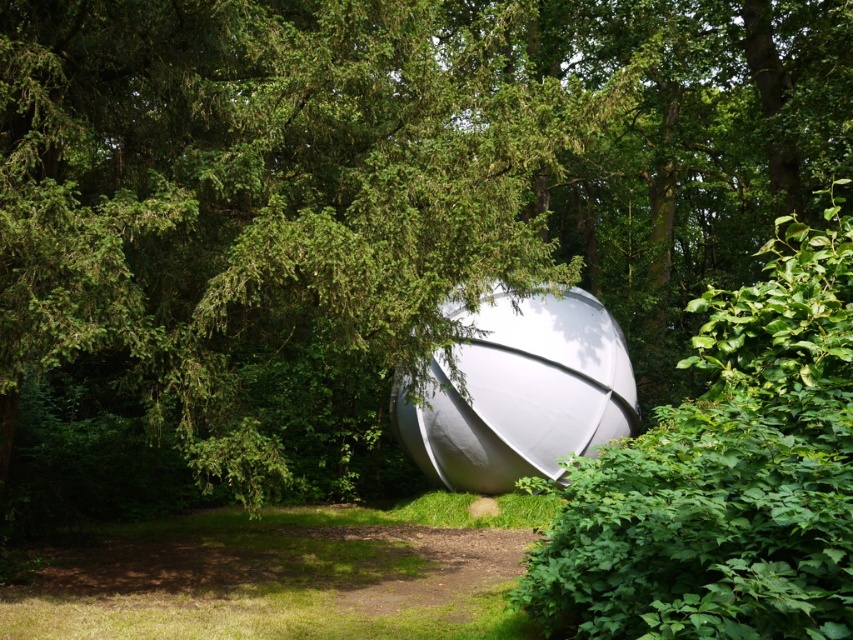
Is point (820, 420) positioned in front of point (543, 461)?

Yes.

Is green leafy bush at center thinner than white matte sphere at center?

Yes, green leafy bush at center is thinner than white matte sphere at center.

Find the location of a particular element. green leafy bush at center is located at coordinates (724, 474).

This screenshot has width=853, height=640. Find the location of `green leafy bush at center`. green leafy bush at center is located at coordinates (724, 474).

Measure the distance between point [666,552] and camera.

Point [666,552] is 4.29 meters from camera.

Does green leafy bush at center have a smaller size compared to green grass at lower center?

Yes.

Find the location of a particular element. green leafy bush at center is located at coordinates (724, 474).

In the scene shown: Is green grass at lower center taller than white matte sphere at center?

Incorrect, green grass at lower center's height is not larger of white matte sphere at center's.

Is green grass at lower center positioned behind white matte sphere at center?

No, green grass at lower center is in front of white matte sphere at center.

This screenshot has height=640, width=853. I want to click on green grass at lower center, so click(x=286, y=573).